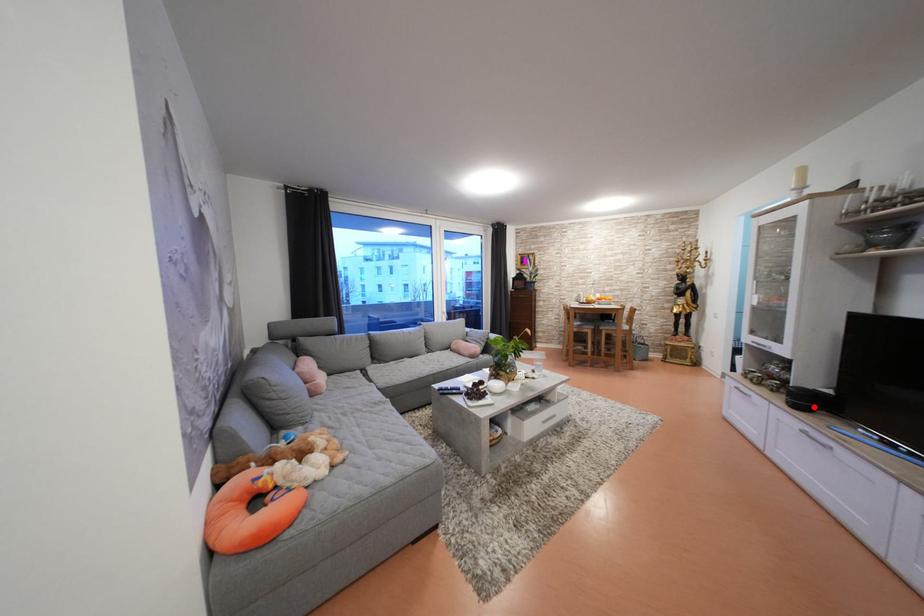
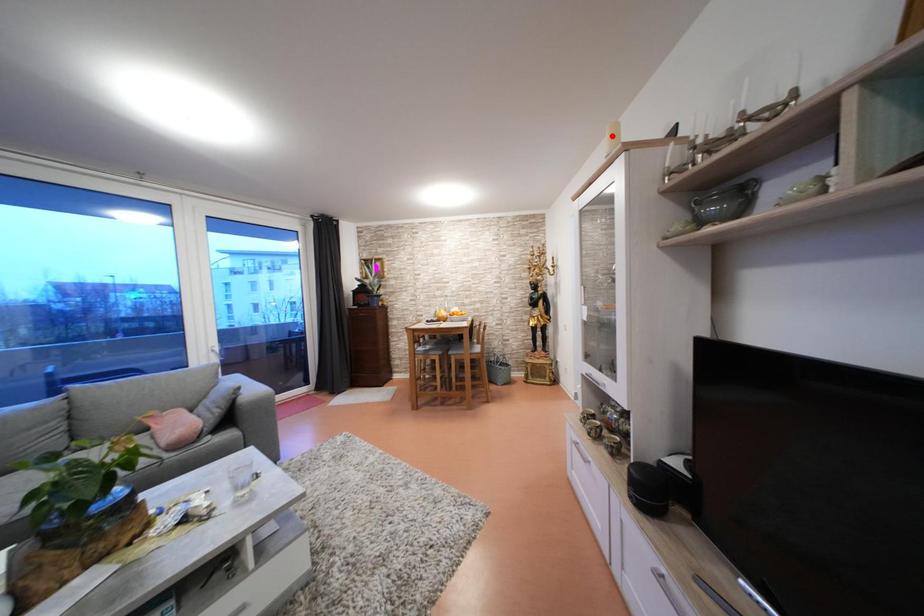
I am providing you with two images of the same scene from different viewpoints. A red point is marked on the first image and another point is marked on the second image. Do the highlighted points in image1 and image2 indicate the same real-world spot?

No